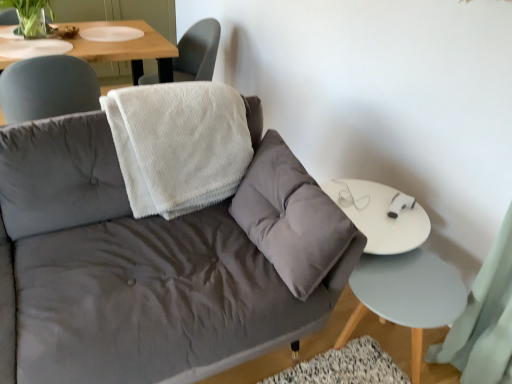
Question: Should I look upward or downward to see green matte plant at upper left?

Choices:
 (A) up
 (B) down

Answer: (A)

Question: Considering the relative sizes of white textured towel at upper center and light blue wood side table at lower right in the image provided, is white textured towel at upper center smaller than light blue wood side table at lower right?

Choices:
 (A) no
 (B) yes

Answer: (A)

Question: Is white textured towel at upper center in front of light blue wood side table at lower right?

Choices:
 (A) no
 (B) yes

Answer: (A)

Question: Does white textured towel at upper center appear on the right side of light blue wood side table at lower right?

Choices:
 (A) no
 (B) yes

Answer: (A)

Question: Can you confirm if white textured towel at upper center is wider than light blue wood side table at lower right?

Choices:
 (A) yes
 (B) no

Answer: (A)

Question: Is white textured towel at upper center looking in the opposite direction of light blue wood side table at lower right?

Choices:
 (A) yes
 (B) no

Answer: (B)

Question: Could you tell me if white textured towel at upper center is turned towards light blue wood side table at lower right?

Choices:
 (A) yes
 (B) no

Answer: (B)

Question: Would you say light blue wood side table at lower right is a long distance from green matte plant at upper left?

Choices:
 (A) yes
 (B) no

Answer: (A)

Question: From the image's perspective, is light blue wood side table at lower right over green matte plant at upper left?

Choices:
 (A) no
 (B) yes

Answer: (A)

Question: Does light blue wood side table at lower right have a greater height compared to green matte plant at upper left?

Choices:
 (A) yes
 (B) no

Answer: (A)

Question: Considering the relative sizes of light blue wood side table at lower right and green matte plant at upper left in the image provided, is light blue wood side table at lower right bigger than green matte plant at upper left?

Choices:
 (A) yes
 (B) no

Answer: (A)

Question: Is light blue wood side table at lower right beside green matte plant at upper left?

Choices:
 (A) yes
 (B) no

Answer: (B)

Question: Is light blue wood side table at lower right further to the viewer compared to green matte plant at upper left?

Choices:
 (A) yes
 (B) no

Answer: (B)

Question: Does white fluffy blanket at upper center have a lesser height compared to velvet gray couch at center?

Choices:
 (A) no
 (B) yes

Answer: (B)